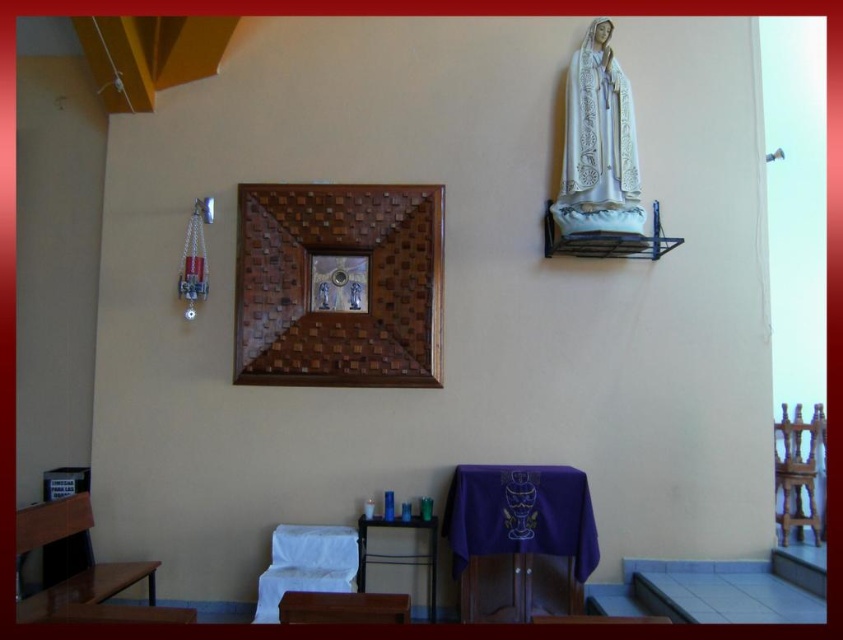
You are an interior designer planning to add a new light fixture between the white lace robe at upper right and the wooden chair at right. Based on their positions, where should the light fixture be placed?

The light fixture should be placed between the white lace robe at upper right and the wooden chair at right, below the robe and above the chair since the robe is located above the chair.

You are a visitor standing in the church and want to place a 3.5 feet wide decorative item between the white lace robe at upper right and the wooden chair at right. Will there be enough space?

The distance between the white lace robe at upper right and the wooden chair at right is 5.69 feet, which is more than the 3.5 feet width of the decorative item. Therefore, there is enough space to place the item between them.

You are standing in the church and want to sit down on the white fabric chair at lower center. To reach it, you need to walk past the woven wood picture frame at upper center. Is the chair closer to you than the frame?

The woven wood picture frame at upper center is further to the viewer than white fabric chair at lower center, so the chair is farther away. Therefore, you would need to walk past the frame to reach the chair, but the chair is not closer to you than the frame.